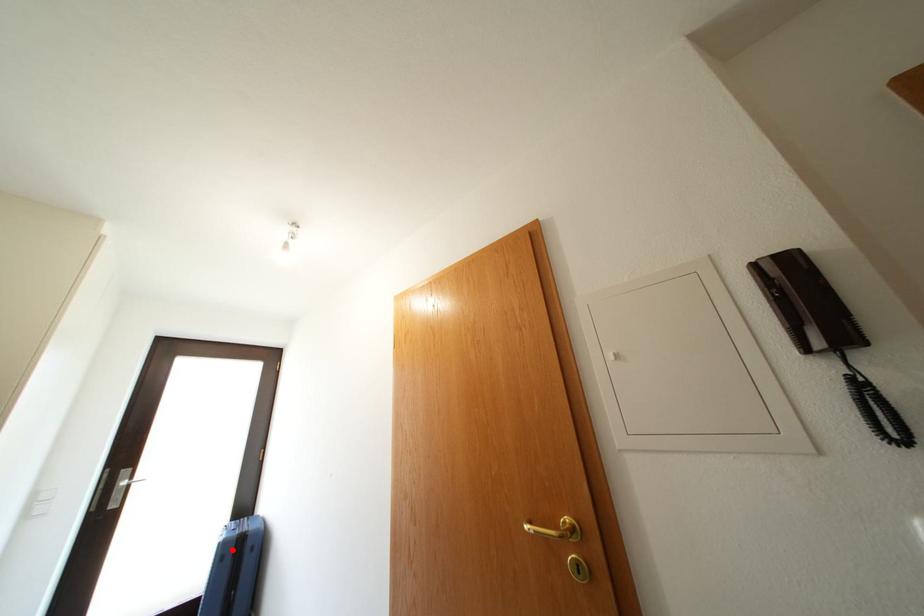
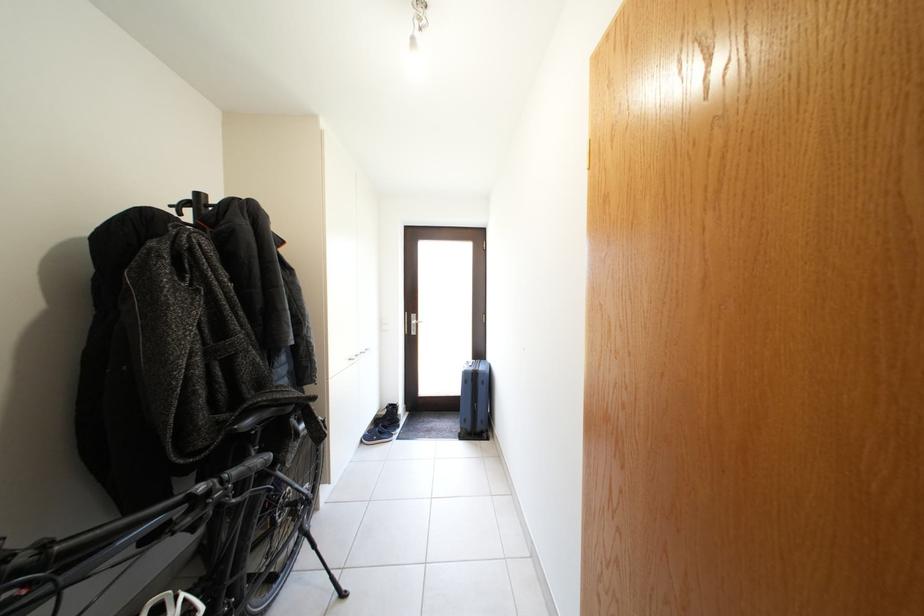
Question: I am providing you with two images of the same scene from different viewpoints. A red point is shown in image1. For the corresponding object point in image2, is it positioned nearer or farther from the camera?

Choices:
 (A) Nearer
 (B) Farther

Answer: (B)